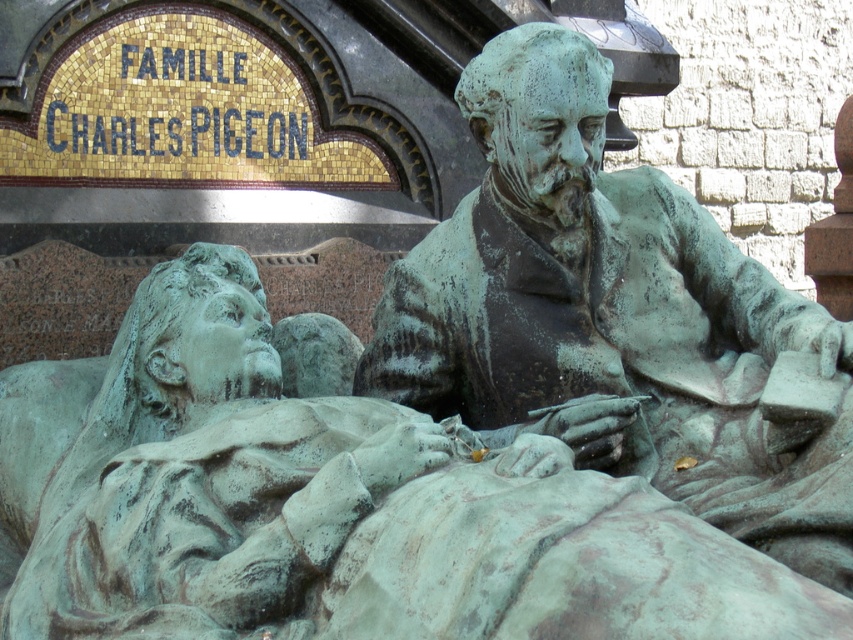
Which is more to the right, green patinated bronze statue at upper center or green patinated bronze statue at center?

From the viewer's perspective, green patinated bronze statue at center appears more on the right side.

Which is above, green patinated bronze statue at upper center or green patinated bronze statue at center?

green patinated bronze statue at center

Is point (33, 552) farther from viewer compared to point (561, 131)?

No, (33, 552) is in front of (561, 131).

Locate an element on the screen. The width and height of the screenshot is (853, 640). green patinated bronze statue at upper center is located at coordinates (329, 506).